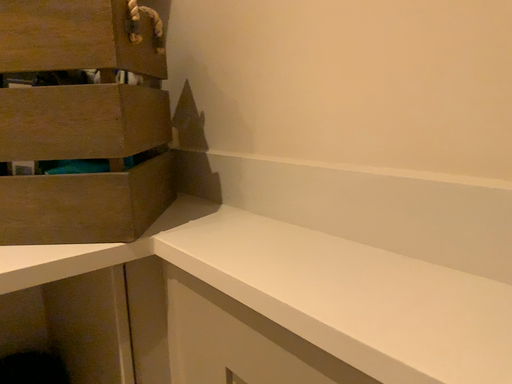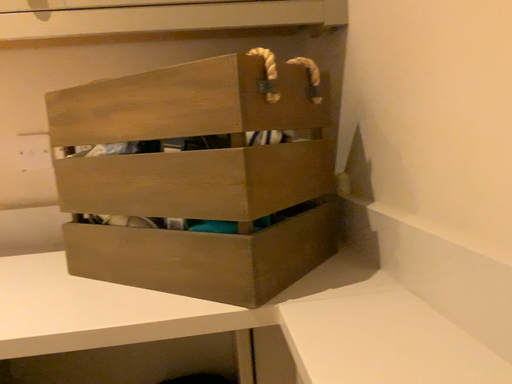
Question: How did the camera likely rotate when shooting the video?

Choices:
 (A) rotated left
 (B) rotated right

Answer: (A)